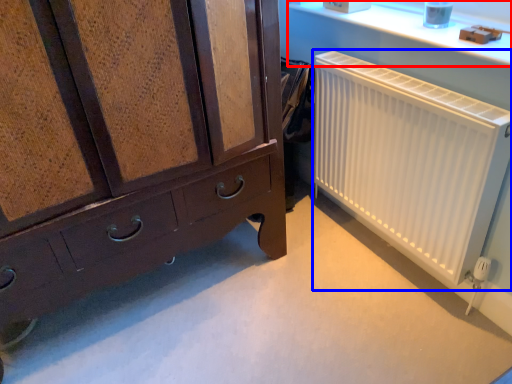
Question: Which object appears closest to the camera in this image, window sill (highlighted by a red box) or radiator (highlighted by a blue box)?

Choices:
 (A) window sill
 (B) radiator

Answer: (B)